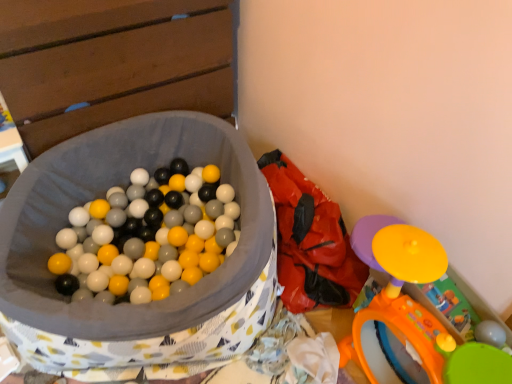
Question: Does red fabric bean bag chair at center appear on the right side of orange plastic toy at lower right?

Choices:
 (A) no
 (B) yes

Answer: (A)

Question: Can you confirm if red fabric bean bag chair at center is shorter than orange plastic toy at lower right?

Choices:
 (A) yes
 (B) no

Answer: (A)

Question: From a real-world perspective, is red fabric bean bag chair at center over orange plastic toy at lower right?

Choices:
 (A) yes
 (B) no

Answer: (B)

Question: From the image's perspective, would you say red fabric bean bag chair at center is shown under orange plastic toy at lower right?

Choices:
 (A) no
 (B) yes

Answer: (A)

Question: Does red fabric bean bag chair at center turn towards orange plastic toy at lower right?

Choices:
 (A) yes
 (B) no

Answer: (B)

Question: Is red fabric bean bag chair at center positioned in front of orange plastic toy at lower right?

Choices:
 (A) no
 (B) yes

Answer: (A)

Question: Does orange plastic toy at lower right have a lesser width compared to red fabric bean bag chair at center?

Choices:
 (A) yes
 (B) no

Answer: (A)

Question: Is orange plastic toy at lower right oriented towards red fabric bean bag chair at center?

Choices:
 (A) yes
 (B) no

Answer: (B)

Question: From a real-world perspective, does orange plastic toy at lower right sit lower than red fabric bean bag chair at center?

Choices:
 (A) yes
 (B) no

Answer: (B)

Question: From the image's perspective, does orange plastic toy at lower right appear lower than red fabric bean bag chair at center?

Choices:
 (A) no
 (B) yes

Answer: (B)

Question: Can you confirm if orange plastic toy at lower right is positioned to the right of red fabric bean bag chair at center?

Choices:
 (A) yes
 (B) no

Answer: (A)

Question: Is orange plastic toy at lower right shorter than red fabric bean bag chair at center?

Choices:
 (A) no
 (B) yes

Answer: (A)

Question: Based on their positions, is red fabric bean bag chair at center located to the left or right of orange plastic toy at lower right?

Choices:
 (A) right
 (B) left

Answer: (B)